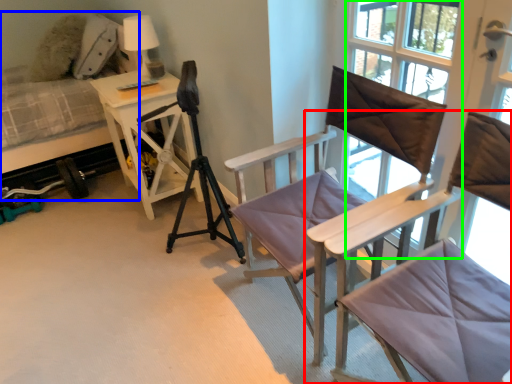
Question: Estimate the real-world distances between objects in this image. Which object is closer to chair (highlighted by a red box), hospital bed (highlighted by a blue box) or window screen (highlighted by a green box)?

Choices:
 (A) hospital bed
 (B) window screen

Answer: (B)